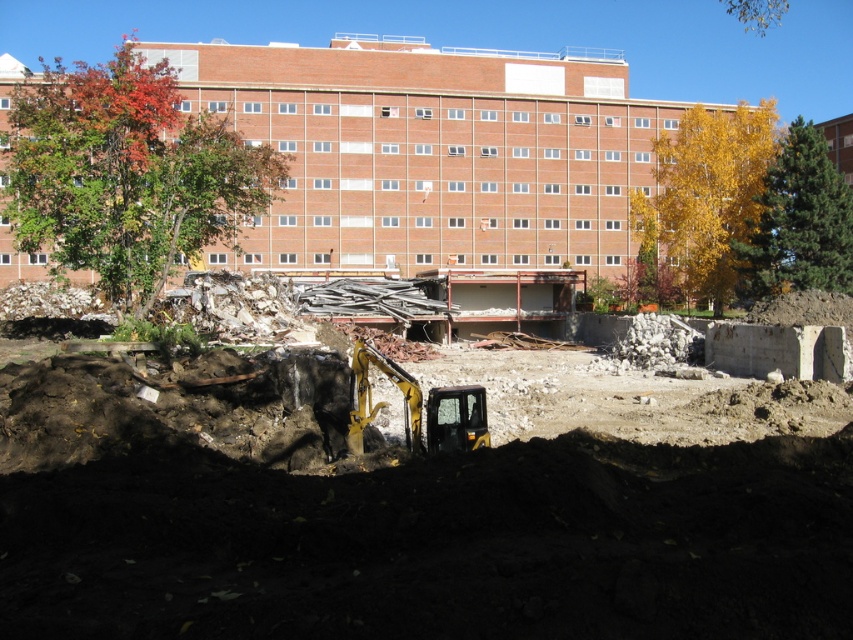
You are a construction worker who needs to move autumn leaves at upper left to the yellow metallic excavator at center. Can you do this task manually without any machinery? Explain your reasoning based on the distance between them.

The autumn leaves at upper left and the yellow metallic excavator at center are 19.44 meters apart. Manually moving them this distance would be physically demanding and time consuming, so it is not advisable to do this task without machinery.